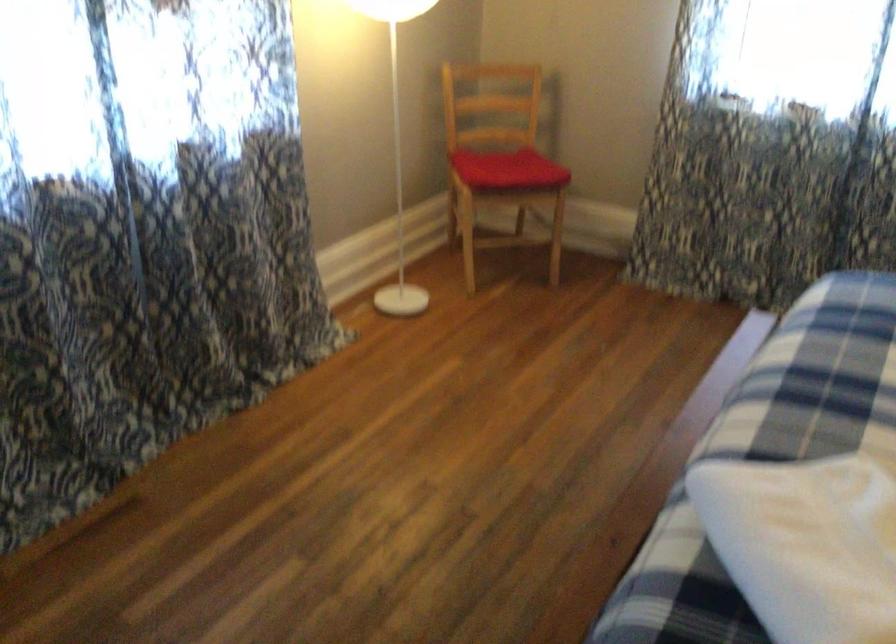
Identify the location of chair sitting surface. [507, 169].